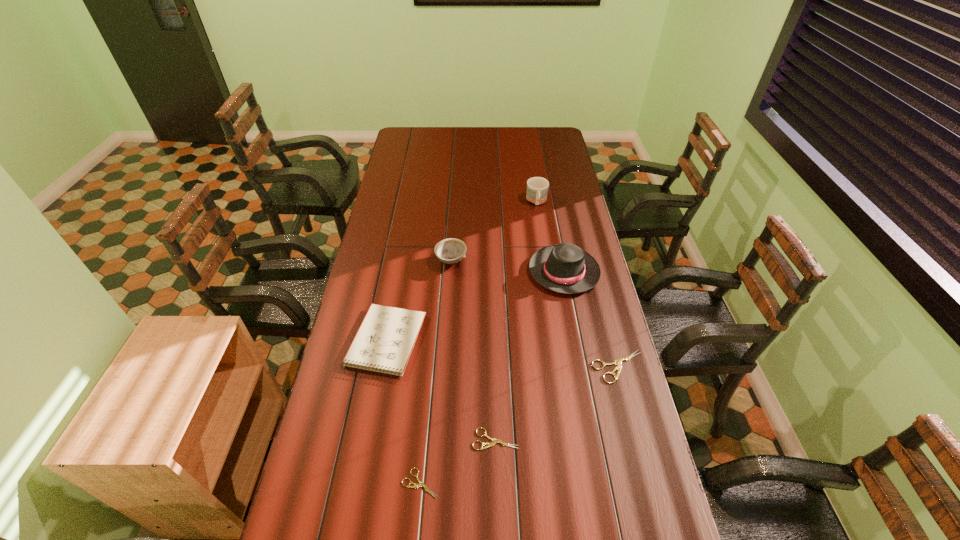
Locate an element on the screen. This screenshot has height=540, width=960. the shortest object is located at coordinates (421, 484).

I want to click on the leftmost shears, so click(x=421, y=484).

The image size is (960, 540). In order to click on the second nearest object in this screenshot , I will do `click(489, 444)`.

Where is `the second farthest shears`? The width and height of the screenshot is (960, 540). the second farthest shears is located at coordinates (489, 444).

Identify the location of the rightmost shears. (618, 361).

Image resolution: width=960 pixels, height=540 pixels. I want to click on the farthest shears, so click(618, 361).

The height and width of the screenshot is (540, 960). What are the coordinates of `mug` in the screenshot? It's located at (537, 187).

Find the location of `the fifth shortest object`. the fifth shortest object is located at coordinates (449, 251).

Locate an element on the screen. The width and height of the screenshot is (960, 540). the fourth shortest object is located at coordinates (384, 342).

Where is `dress hat`? This screenshot has width=960, height=540. dress hat is located at coordinates (565, 268).